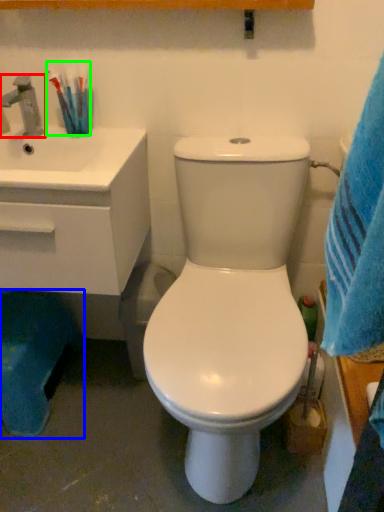
Question: Based on their relative distances, which object is nearer to tap (highlighted by a red box)? Choose from potty (highlighted by a blue box) and toothbrush (highlighted by a green box).

Choices:
 (A) potty
 (B) toothbrush

Answer: (B)